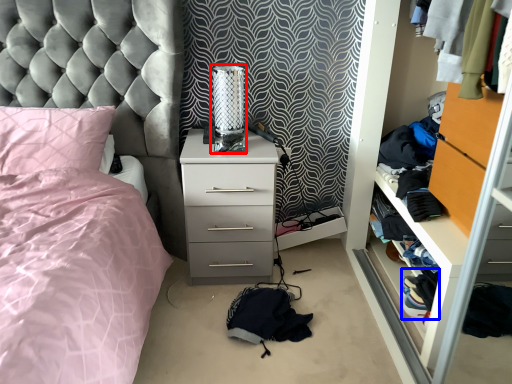
Question: Which object appears closest to the camera in this image, table lamp (highlighted by a red box) or clothing (highlighted by a blue box)?

Choices:
 (A) table lamp
 (B) clothing

Answer: (A)